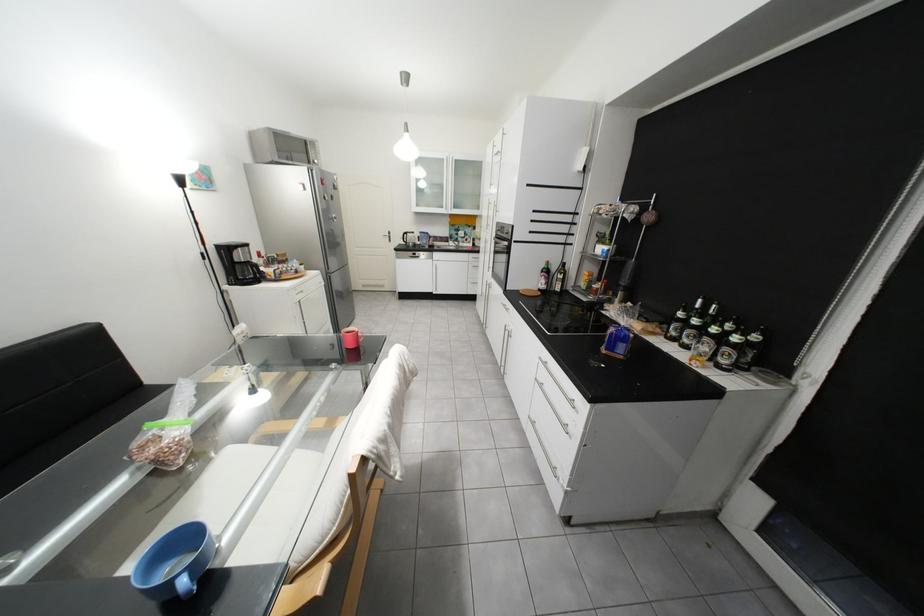
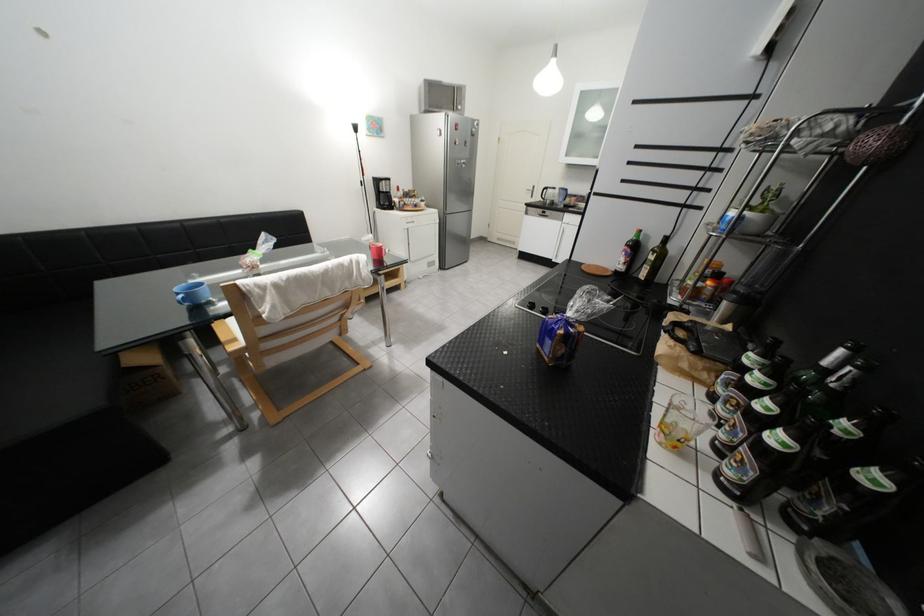
In the second image, find the point that corresponds to point (418, 235) in the first image.

(557, 190)